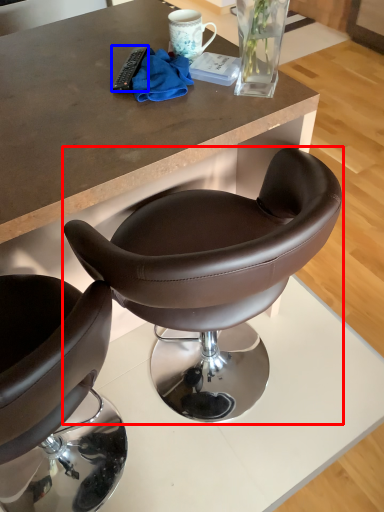
Question: Which point is closer to the camera, chair (highlighted by a red box) or remote control (highlighted by a blue box)?

Choices:
 (A) chair
 (B) remote control

Answer: (A)